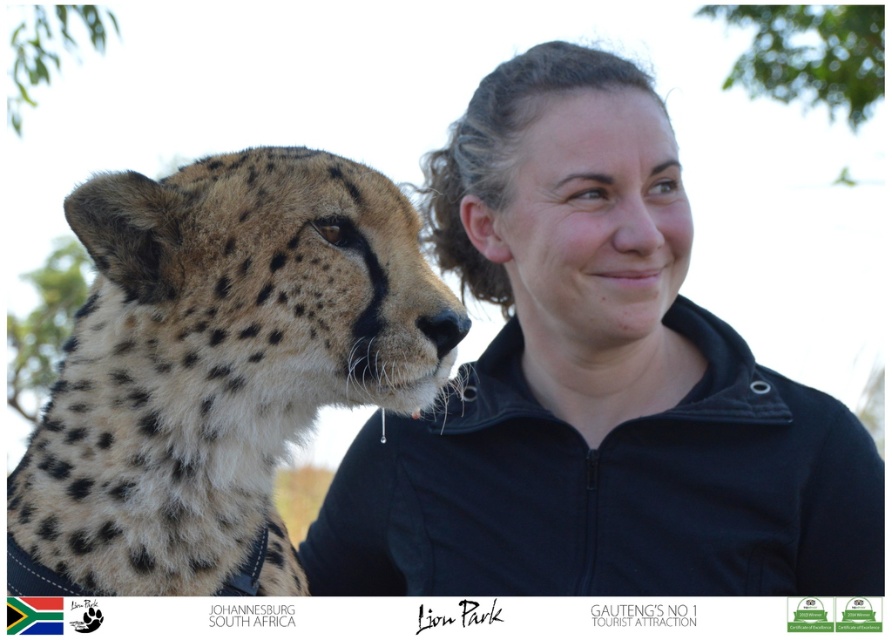
Does matte black jacket at center appear over spotted fur cheetah at left?

Yes, matte black jacket at center is above spotted fur cheetah at left.

Is matte black jacket at center further to the viewer compared to spotted fur cheetah at left?

Yes, it is behind spotted fur cheetah at left.

Does point (612, 212) come behind point (395, 364)?

That is True.

The image size is (892, 640). Identify the location of matte black jacket at center. (593, 387).